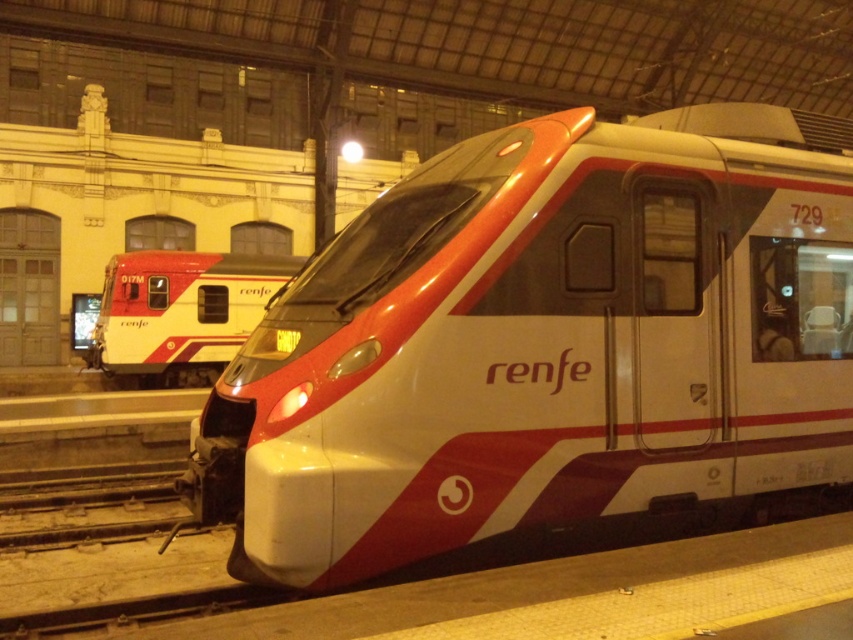
Consider the image. You are a passenger waiting at the train station and need to board the train that can accommodate more passengers. Based on the scene, which train should you choose between the matte white train at center and the matte white train at left?

The matte white train at left is wider than the matte white train at center, so it can accommodate more passengers. Therefore, you should choose the matte white train at left.

You are standing at the train station and see the point marked at coordinates (x=544, y=344). What object is located at that point?

The point at coordinates (x=544, y=344) marks the matte white train at center.